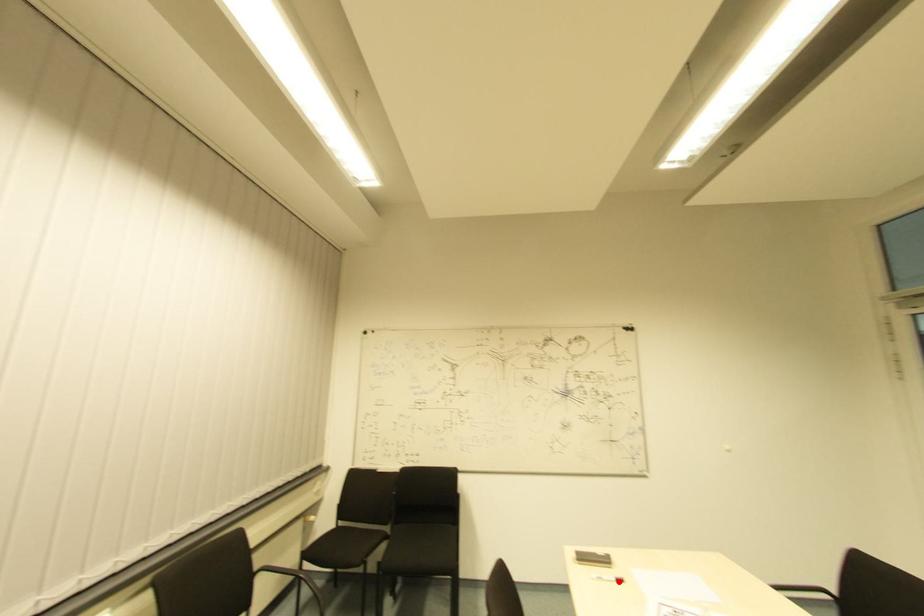
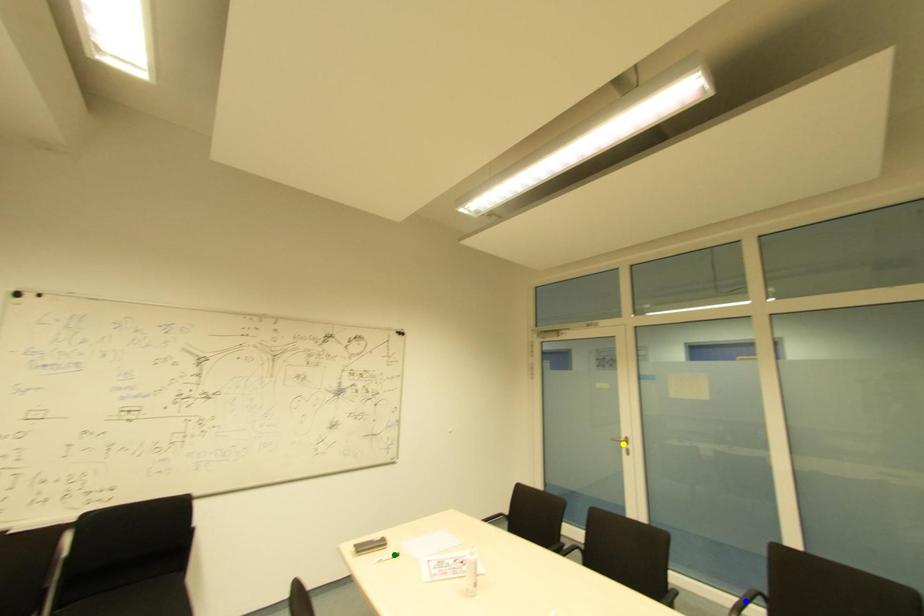
Question: I am providing you with two images of the same scene from different viewpoints. A red point is marked on the first image. You are given multiple points on the second image. In image 2, which mark is for the same physical point as the one in image 1?

Choices:
 (A) green point
 (B) blue point
 (C) yellow point

Answer: (A)